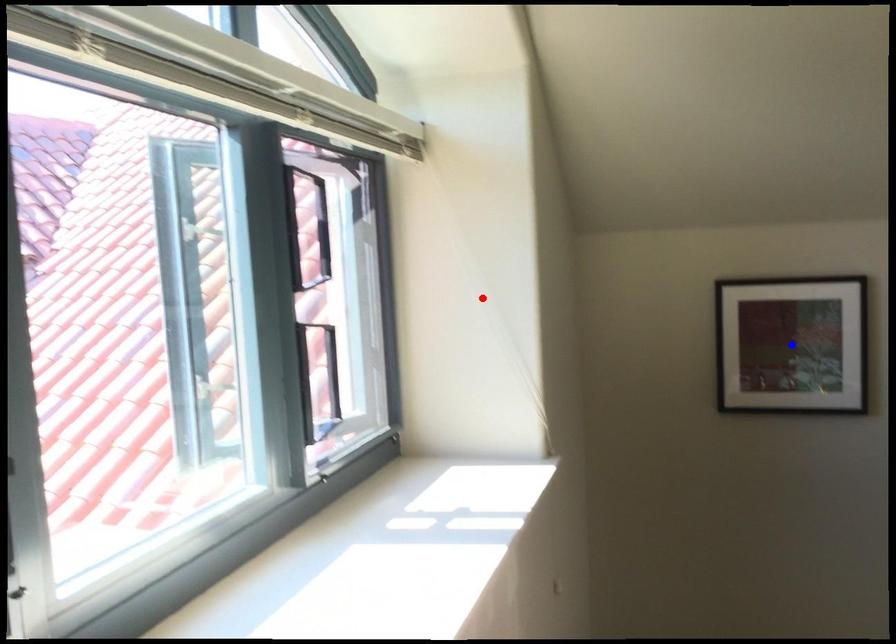
Question: Which of the two points in the image is closer to the camera?

Choices:
 (A) Blue point is closer.
 (B) Red point is closer.

Answer: (B)